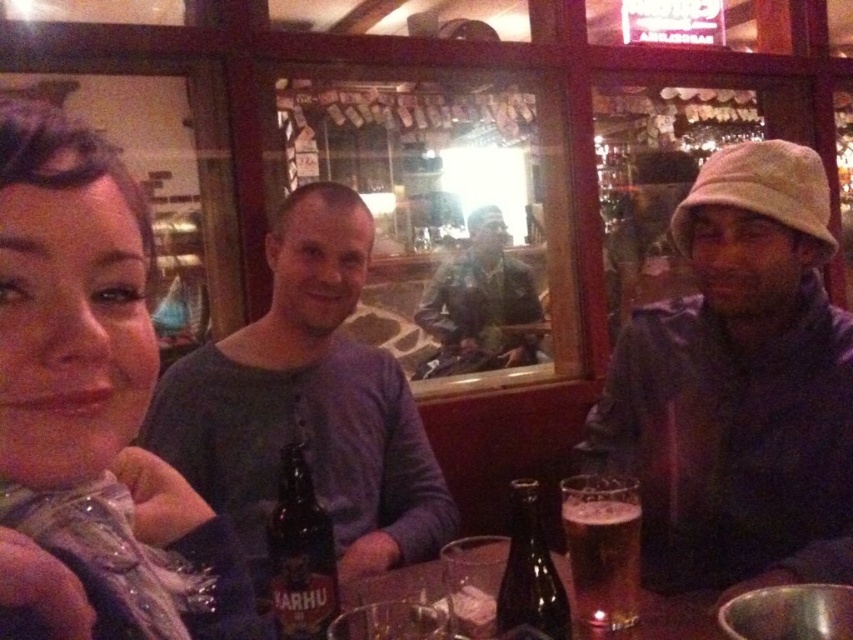
Is point (338, 340) positioned before point (567, 557)?

That is False.

Can you confirm if purple soft sweater at center is positioned to the left of translucent glass beer at center?

Yes, purple soft sweater at center is to the left of translucent glass beer at center.

Identify the location of purple soft sweater at center. (306, 404).

Does brown glass bottle at center have a smaller size compared to dark brown glass bottle at center?

Yes, brown glass bottle at center is smaller than dark brown glass bottle at center.

Does brown glass bottle at center have a larger size compared to dark brown glass bottle at center?

Incorrect, brown glass bottle at center is not larger than dark brown glass bottle at center.

Is point (306, 561) in front of point (548, 612)?

No, it is behind (548, 612).

The width and height of the screenshot is (853, 640). Find the location of `brown glass bottle at center`. brown glass bottle at center is located at coordinates (300, 554).

Is matte black scarf at left smaller than dark brown glass bottle at center?

Actually, matte black scarf at left might be larger than dark brown glass bottle at center.

Is point (53, 509) less distant than point (560, 636)?

Yes, it is in front of point (560, 636).

Find the location of a particular element. matte black scarf at left is located at coordinates (96, 394).